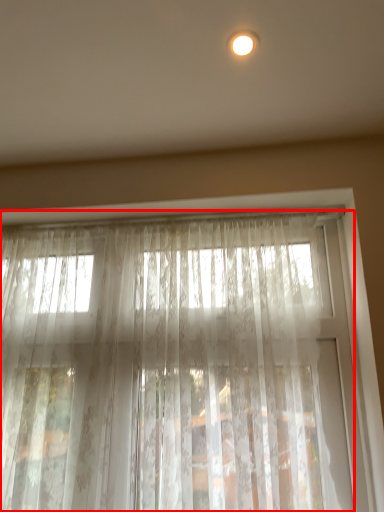
Question: From the image's perspective, what is the correct spatial positioning of curtain (annotated by the red box) in reference to lighting?

Choices:
 (A) above
 (B) below

Answer: (B)